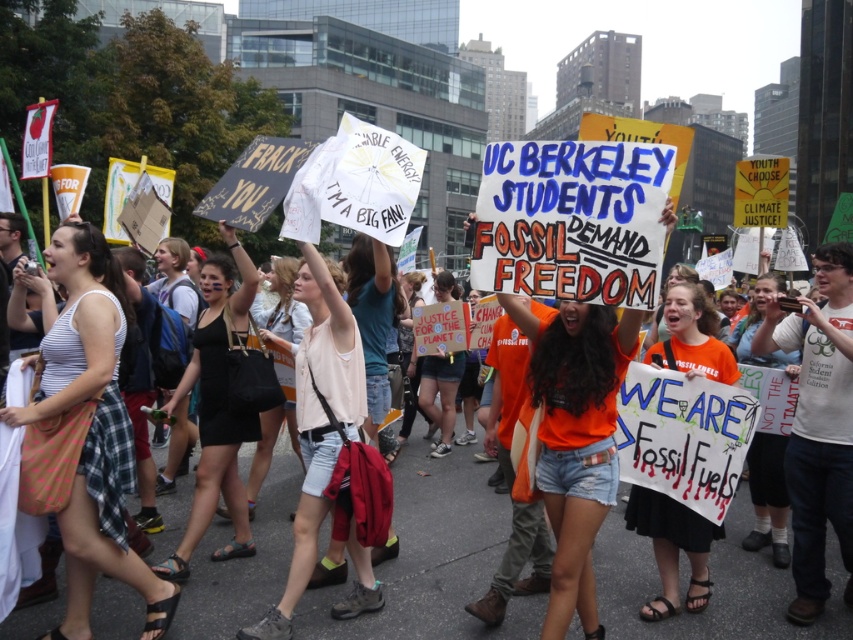
Between light pink cotton shirt at center and denim shorts at center, which one appears on the right side from the viewer's perspective?

From the viewer's perspective, denim shorts at center appears more on the right side.

You are a GUI agent. You are given a task and a screenshot of the screen. Output one action in this format:
    pyautogui.click(x=<x>, y=<y>)
    Task: Click on the light pink cotton shirt at center
    
    Given the screenshot: What is the action you would take?
    pyautogui.click(x=318, y=419)

Is point (340, 324) more distant than point (412, 336)?

No, it is not.

At what (x,y) coordinates should I click in order to perform the action: click on light pink cotton shirt at center. Please return your answer as a coordinate pair (x, y). This screenshot has width=853, height=640. Looking at the image, I should click on (318, 419).

Does black fabric dress at center have a lesser height compared to light pink fabric shirt at center?

No, black fabric dress at center is not shorter than light pink fabric shirt at center.

Where is `black fabric dress at center`? This screenshot has width=853, height=640. black fabric dress at center is located at coordinates (216, 406).

Image resolution: width=853 pixels, height=640 pixels. I want to click on black fabric dress at center, so click(216, 406).

Between orange cotton t-shirt at center and light pink cotton shirt at center, which one appears on the right side from the viewer's perspective?

orange cotton t-shirt at center

Does orange cotton t-shirt at center have a greater height compared to light pink cotton shirt at center?

Incorrect, orange cotton t-shirt at center's height is not larger of light pink cotton shirt at center's.

Who is more forward, (416, 548) or (308, 253)?

Point (308, 253) is in front.

Locate an element on the screen. This screenshot has width=853, height=640. orange cotton t-shirt at center is located at coordinates (433, 560).